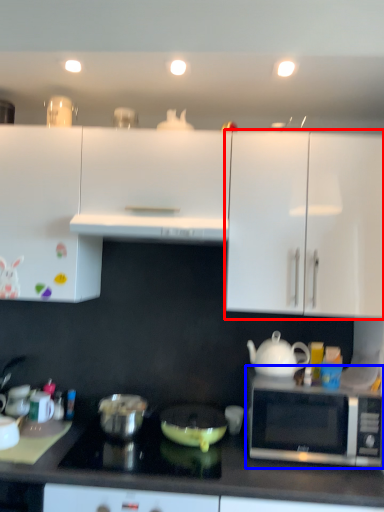
Question: Which point is closer to the camera, cabinetry (highlighted by a red box) or microwave oven (highlighted by a blue box)?

Choices:
 (A) cabinetry
 (B) microwave oven

Answer: (B)